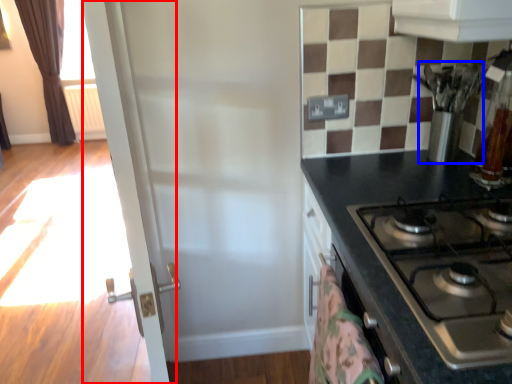
Question: Which point is closer to the camera, screen door (highlighted by a red box) or appliance (highlighted by a blue box)?

Choices:
 (A) screen door
 (B) appliance

Answer: (A)